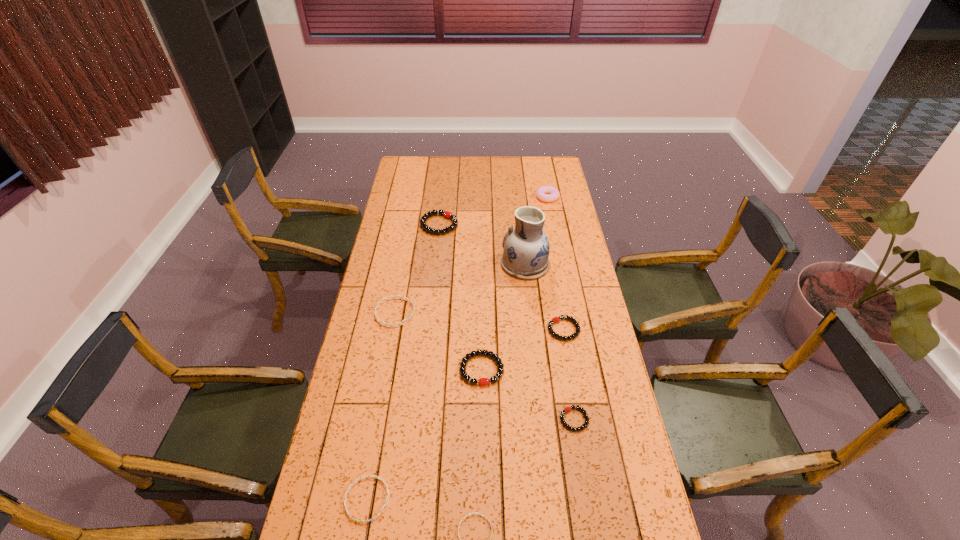
Locate an element on the screen. This screenshot has height=540, width=960. the tallest object is located at coordinates (526, 247).

Locate an element on the screen. pottery is located at coordinates (526, 247).

Find the location of `the farthest object`. the farthest object is located at coordinates (545, 193).

You are a GUI agent. You are given a task and a screenshot of the screen. Output one action in this format:
    pyautogui.click(x=<x>, y=<y>)
    Task: Click on the doughnut
    The height and width of the screenshot is (540, 960).
    Given the screenshot: What is the action you would take?
    pyautogui.click(x=545, y=193)

The height and width of the screenshot is (540, 960). Find the location of `the third tallest object`. the third tallest object is located at coordinates (447, 214).

Where is `the tallest bracelet`? the tallest bracelet is located at coordinates (447, 214).

This screenshot has height=540, width=960. What are the coordinates of `the sixth farthest object` in the screenshot? It's located at (482, 381).

I want to click on the second black bracelet from left to right, so click(x=482, y=381).

The image size is (960, 540). I want to click on the biggest blue bracelet, so click(401, 297).

At what (x,y) coordinates should I click in order to perform the action: click on the second smallest black bracelet. Please return your answer as a coordinate pair (x, y). Looking at the image, I should click on (556, 319).